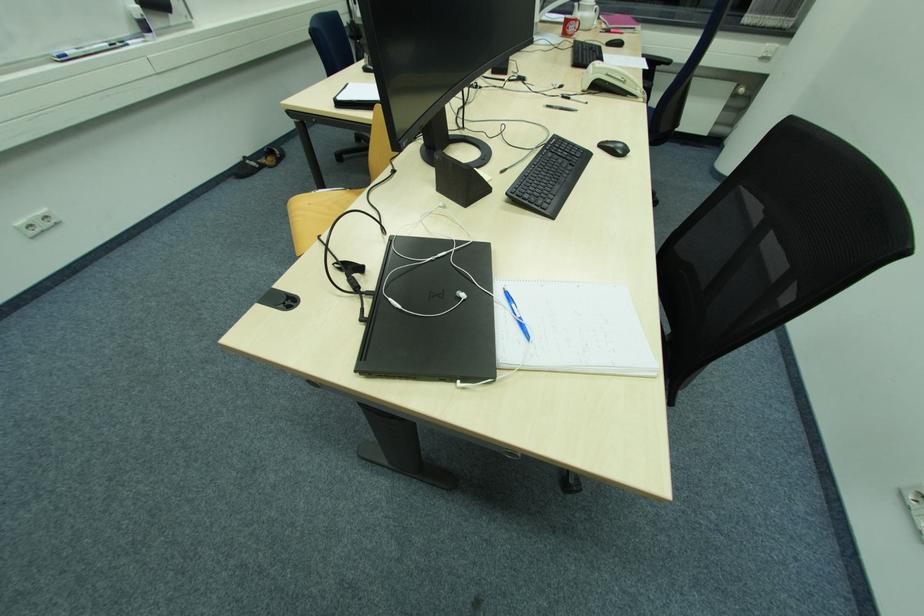
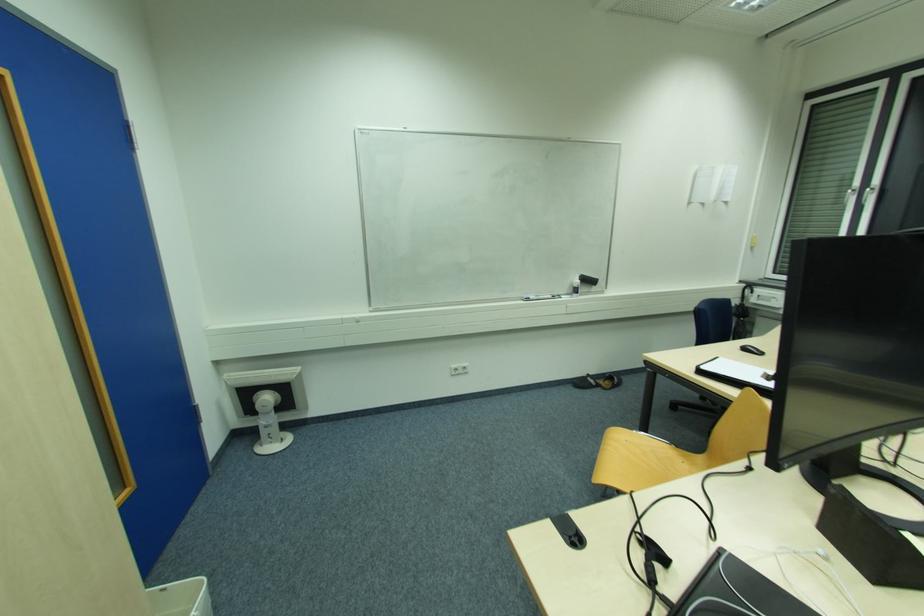
Where in the second image is the point corresponding to (290,302) from the first image?

(578, 541)